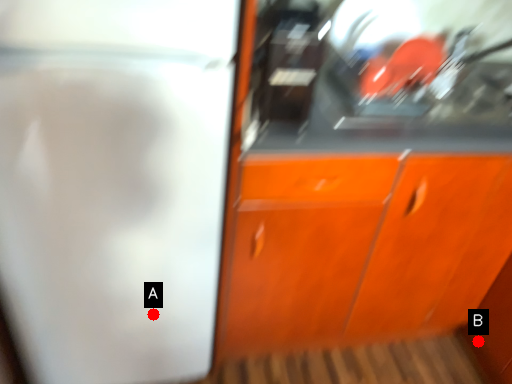
Question: Two points are circled on the image, labeled by A and B beside each circle. Which point is closer to the camera taking this photo?

Choices:
 (A) A is closer
 (B) B is closer

Answer: (A)